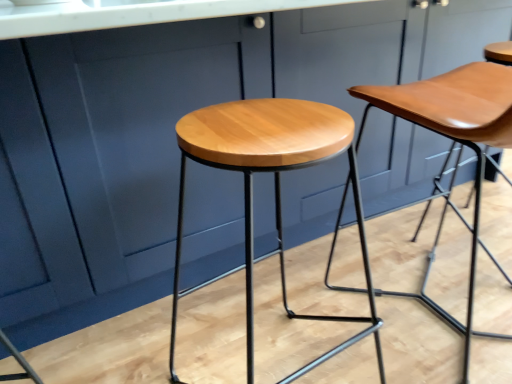
What do you see at coordinates (454, 141) in the screenshot? I see `matte wood stool at center, which is counted as the 2th stool, starting from the left` at bounding box center [454, 141].

At what (x,y) coordinates should I click in order to perform the action: click on matte wood stool at center, which is counted as the 2th stool, starting from the left. Please return your answer as a coordinate pair (x, y). The height and width of the screenshot is (384, 512). Looking at the image, I should click on (454, 141).

Image resolution: width=512 pixels, height=384 pixels. I want to click on light brown wood stool at center, which is counted as the second stool, starting from the right, so click(275, 185).

Describe the element at coordinates (275, 185) in the screenshot. The height and width of the screenshot is (384, 512). I see `light brown wood stool at center, which is counted as the second stool, starting from the right` at that location.

Find the location of a particular element. The width and height of the screenshot is (512, 384). matte wood stool at center, which is counted as the 2th stool, starting from the left is located at coordinates (454, 141).

Which is more to the right, matte wood stool at center, which is counted as the 2th stool, starting from the left, or light brown wood stool at center, which is the first stool from left to right?

matte wood stool at center, which is counted as the 2th stool, starting from the left, is more to the right.

Considering the positions of objects matte wood stool at center, which is counted as the 2th stool, starting from the left, and light brown wood stool at center, which is counted as the second stool, starting from the right, in the image provided, who is behind, matte wood stool at center, which is counted as the 2th stool, starting from the left, or light brown wood stool at center, which is counted as the second stool, starting from the right,?

matte wood stool at center, which is counted as the 2th stool, starting from the left, is further from the camera.

Which is less distant, (447, 115) or (221, 160)?

Point (447, 115) appears to be farther away from the viewer than point (221, 160).

From the image's perspective, is matte wood stool at center, which is counted as the 2th stool, starting from the left, located above or below light brown wood stool at center, which is counted as the second stool, starting from the right?

Clearly, from the image's perspective, matte wood stool at center, which is counted as the 2th stool, starting from the left, is above light brown wood stool at center, which is counted as the second stool, starting from the right.

In the scene shown: From a real-world perspective, who is located higher, matte wood stool at center, the first stool viewed from the right, or light brown wood stool at center, which is the first stool from left to right?

matte wood stool at center, the first stool viewed from the right.

Considering the relative sizes of matte wood stool at center, the first stool viewed from the right, and light brown wood stool at center, which is the first stool from left to right, in the image provided, is matte wood stool at center, the first stool viewed from the right, wider than light brown wood stool at center, which is the first stool from left to right,?

Yes.

Between matte wood stool at center, which is counted as the 2th stool, starting from the left, and light brown wood stool at center, which is counted as the second stool, starting from the right, which one has less height?

With less height is light brown wood stool at center, which is counted as the second stool, starting from the right.

Considering the sizes of matte wood stool at center, which is counted as the 2th stool, starting from the left, and light brown wood stool at center, which is the first stool from left to right, in the image, is matte wood stool at center, which is counted as the 2th stool, starting from the left, bigger or smaller than light brown wood stool at center, which is the first stool from left to right,?

In the image, matte wood stool at center, which is counted as the 2th stool, starting from the left, appears to be larger than light brown wood stool at center, which is the first stool from left to right.

Is matte wood stool at center, which is counted as the 2th stool, starting from the left, positioned beyond the bounds of light brown wood stool at center, which is counted as the second stool, starting from the right?

That's correct, matte wood stool at center, which is counted as the 2th stool, starting from the left, is outside of light brown wood stool at center, which is counted as the second stool, starting from the right.

Is matte wood stool at center, the first stool viewed from the right, not close to light brown wood stool at center, which is the first stool from left to right?

That's not correct — matte wood stool at center, the first stool viewed from the right, is a little close to light brown wood stool at center, which is the first stool from left to right.

Is matte wood stool at center, which is counted as the 2th stool, starting from the left, turned away from light brown wood stool at center, which is counted as the second stool, starting from the right?

No, matte wood stool at center, which is counted as the 2th stool, starting from the left,'s orientation is not away from light brown wood stool at center, which is counted as the second stool, starting from the right.

Can you tell me how much matte wood stool at center, the first stool viewed from the right, and light brown wood stool at center, which is counted as the second stool, starting from the right, differ in facing direction?

2.38 degrees.

Locate an element on the screen. stool on the right of the light brown wood stool at center, which is counted as the second stool, starting from the right is located at coordinates (454, 141).

Which is more to the right, light brown wood stool at center, which is the first stool from left to right, or matte wood stool at center, which is counted as the 2th stool, starting from the left?

Positioned to the right is matte wood stool at center, which is counted as the 2th stool, starting from the left.

Which object is more forward, light brown wood stool at center, which is the first stool from left to right, or matte wood stool at center, the first stool viewed from the right?

light brown wood stool at center, which is the first stool from left to right.

Does point (276, 201) appear closer or farther from the camera than point (468, 127)?

Clearly, point (276, 201) is more distant from the camera than point (468, 127).

From the image's perspective, is light brown wood stool at center, which is counted as the second stool, starting from the right, on top of matte wood stool at center, which is counted as the 2th stool, starting from the left?

No, from the image's perspective, light brown wood stool at center, which is counted as the second stool, starting from the right, is not over matte wood stool at center, which is counted as the 2th stool, starting from the left.

From a real-world perspective, between light brown wood stool at center, which is the first stool from left to right, and matte wood stool at center, the first stool viewed from the right, who is vertically higher?

From a 3D spatial view, matte wood stool at center, the first stool viewed from the right, is above.

Can you confirm if light brown wood stool at center, which is the first stool from left to right, is thinner than matte wood stool at center, the first stool viewed from the right?

Correct, the width of light brown wood stool at center, which is the first stool from left to right, is less than that of matte wood stool at center, the first stool viewed from the right.

From the picture: From their relative heights in the image, would you say light brown wood stool at center, which is counted as the second stool, starting from the right, is taller or shorter than matte wood stool at center, the first stool viewed from the right?

Considering their sizes, light brown wood stool at center, which is counted as the second stool, starting from the right, has less height than matte wood stool at center, the first stool viewed from the right.

Considering the relative sizes of light brown wood stool at center, which is counted as the second stool, starting from the right, and matte wood stool at center, the first stool viewed from the right, in the image provided, is light brown wood stool at center, which is counted as the second stool, starting from the right, bigger than matte wood stool at center, the first stool viewed from the right,?

Incorrect, light brown wood stool at center, which is counted as the second stool, starting from the right, is not larger than matte wood stool at center, the first stool viewed from the right.

Based on the photo, would you say light brown wood stool at center, which is counted as the second stool, starting from the right, contains matte wood stool at center, which is counted as the 2th stool, starting from the left?

No, matte wood stool at center, which is counted as the 2th stool, starting from the left, is not a part of light brown wood stool at center, which is counted as the second stool, starting from the right.

Is light brown wood stool at center, which is counted as the second stool, starting from the right, not close to matte wood stool at center, the first stool viewed from the right?

No, there isn't a large distance between light brown wood stool at center, which is counted as the second stool, starting from the right, and matte wood stool at center, the first stool viewed from the right.

Is light brown wood stool at center, which is the first stool from left to right, facing towards matte wood stool at center, the first stool viewed from the right?

No, light brown wood stool at center, which is the first stool from left to right, is not oriented towards matte wood stool at center, the first stool viewed from the right.

Can you tell me how much light brown wood stool at center, which is the first stool from left to right, and matte wood stool at center, the first stool viewed from the right, differ in facing direction?

The angular difference between light brown wood stool at center, which is the first stool from left to right, and matte wood stool at center, the first stool viewed from the right, is 2.38 degrees.

How distant is light brown wood stool at center, which is the first stool from left to right, from matte wood stool at center, which is counted as the 2th stool, starting from the left?

The distance of light brown wood stool at center, which is the first stool from left to right, from matte wood stool at center, which is counted as the 2th stool, starting from the left, is 16.51 inches.

Locate an element on the screen. stool below the matte wood stool at center, the first stool viewed from the right (from a real-world perspective) is located at coordinates (275, 185).

I want to click on stool behind the light brown wood stool at center, which is counted as the second stool, starting from the right, so click(x=454, y=141).

In order to click on stool that is above the light brown wood stool at center, which is counted as the second stool, starting from the right (from the image's perspective) in this screenshot , I will do (454, 141).